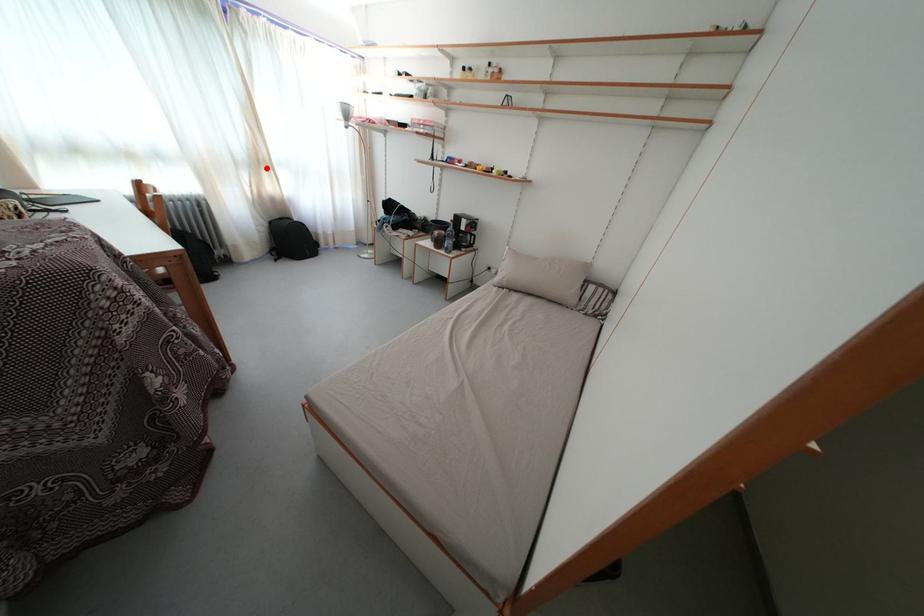
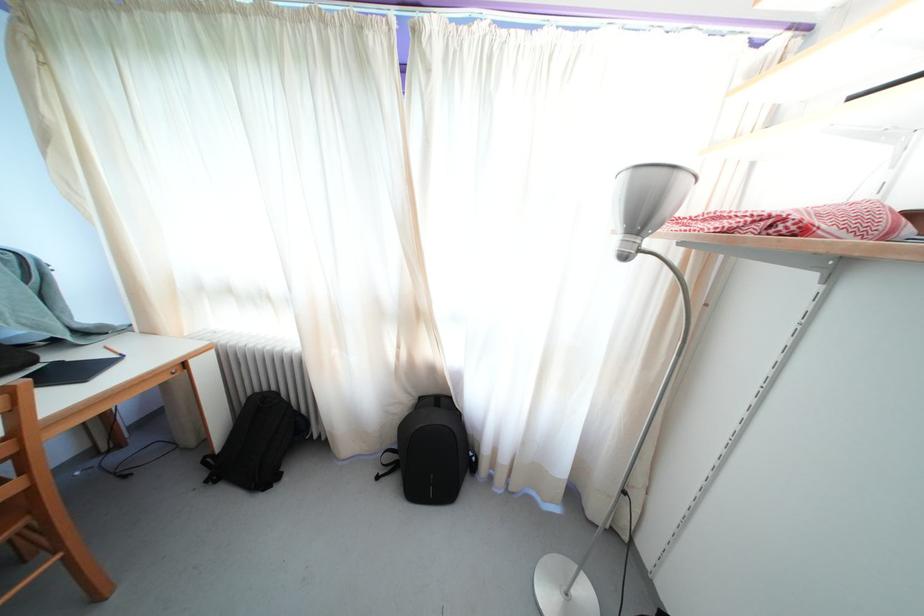
Locate, in the second image, the point that corresponds to the highlighted location in the first image.

(421, 321)